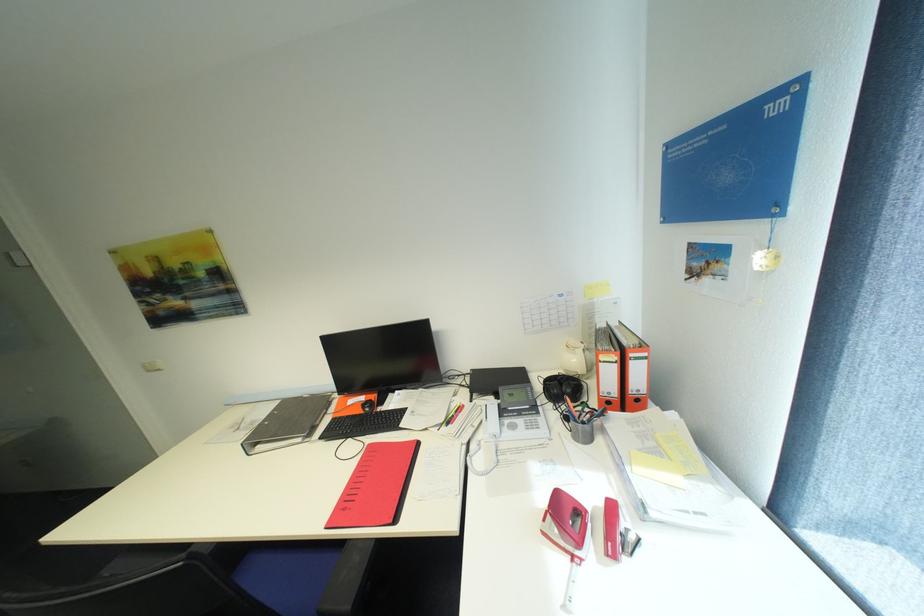
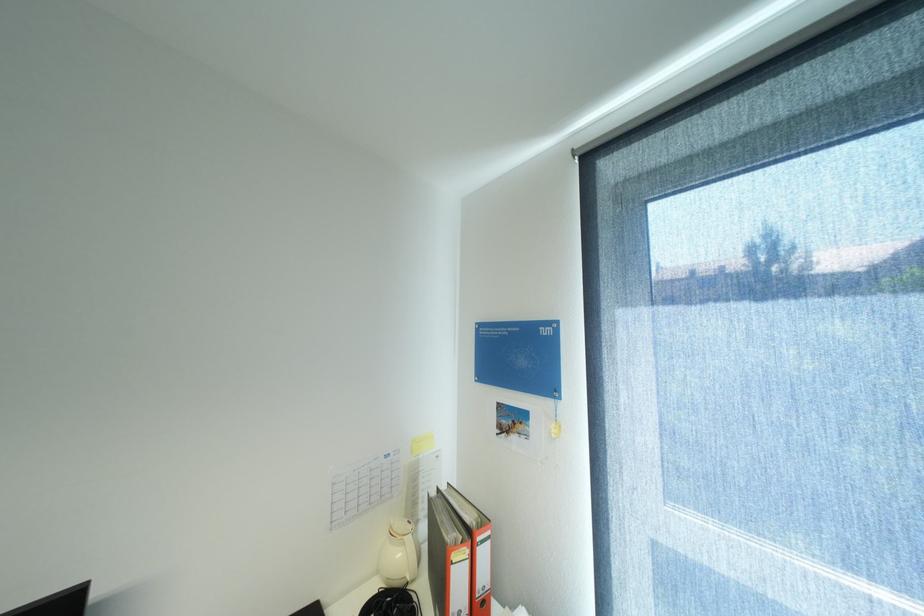
Locate, in the second image, the point that corresponds to the point at 582,361 in the first image.

(407, 554)